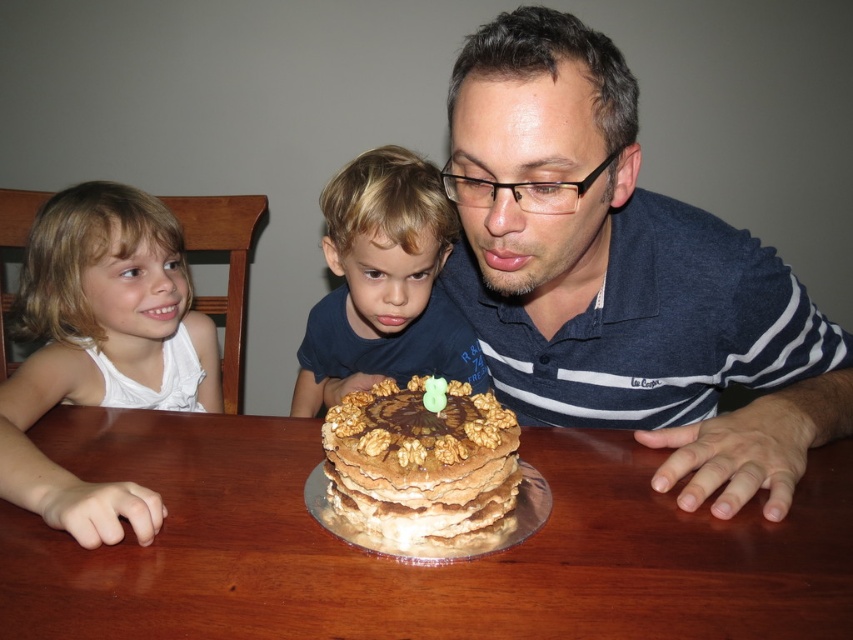
You are a GUI agent. You are given a task and a screenshot of the screen. Output one action in this format:
    pyautogui.click(x=<x>, y=<y>)
    Task: Click on the matte blue shirt at center
    
    Given the screenshot: What is the action you would take?
    pyautogui.click(x=625, y=276)

Does point (717, 289) lie in front of point (155, 316)?

Yes, it is.

Does point (592, 419) come in front of point (122, 305)?

Yes, it is.

Where is `matte blue shirt at center`? The height and width of the screenshot is (640, 853). matte blue shirt at center is located at coordinates (625, 276).

Can you confirm if white fabric shirt at left is smaller than chocolate layered cake at center?

No.

Does point (36, 324) lie in front of point (413, 426)?

No, (36, 324) is behind (413, 426).

This screenshot has width=853, height=640. What are the coordinates of `white fabric shirt at left` in the screenshot? It's located at (102, 348).

Between point (44, 465) and point (363, 353), which one is positioned behind?

The point (363, 353) is more distant.

Who is shorter, white fabric shirt at left or blonde hair boy at center?

Standing shorter between the two is blonde hair boy at center.

In order to click on white fabric shirt at left in this screenshot , I will do 102,348.